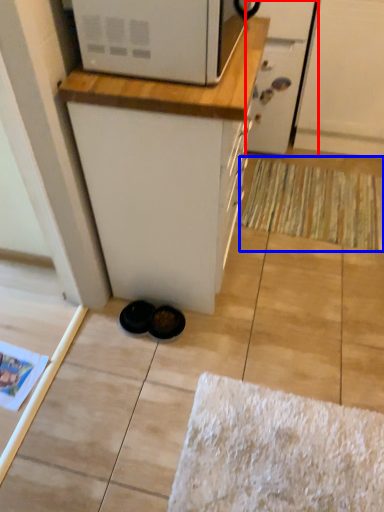
Question: Which of the following is the closest to the observer, screen door (highlighted by a red box) or doormat (highlighted by a blue box)?

Choices:
 (A) screen door
 (B) doormat

Answer: (A)